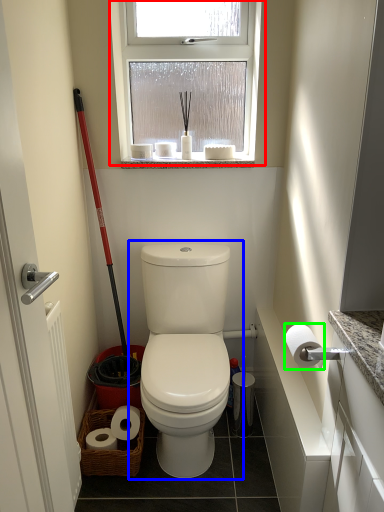
Question: Which object is positioned closest to window (highlighted by a red box)? Select from toilet (highlighted by a blue box) and toilet paper (highlighted by a green box).

Choices:
 (A) toilet
 (B) toilet paper

Answer: (A)